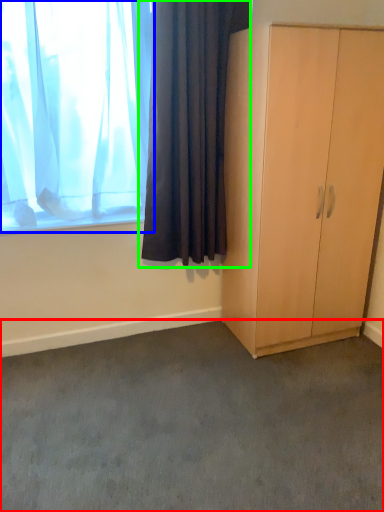
Question: Which object is positioned closest to plain (highlighted by a red box)? Select from curtain (highlighted by a blue box) and curtain (highlighted by a green box).

Choices:
 (A) curtain
 (B) curtain

Answer: (B)